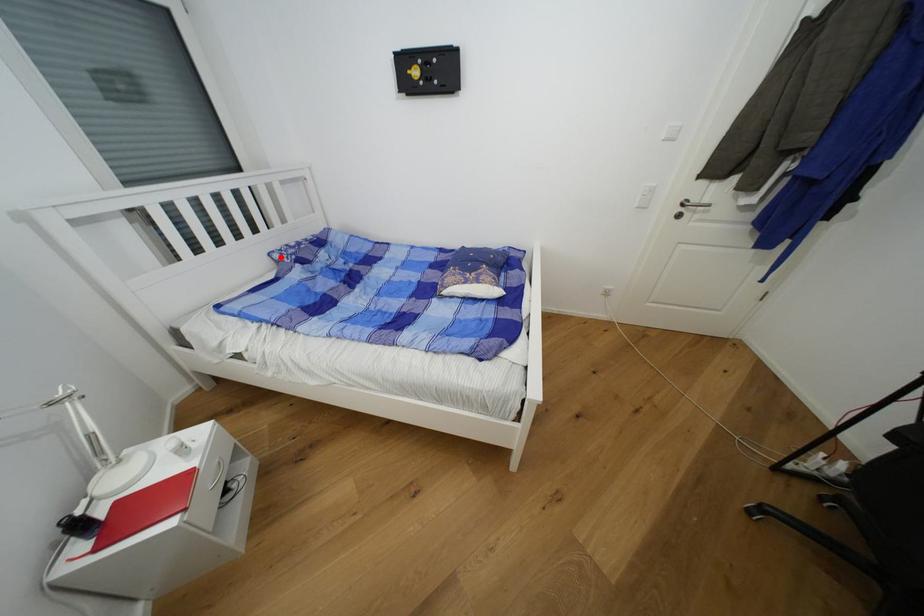
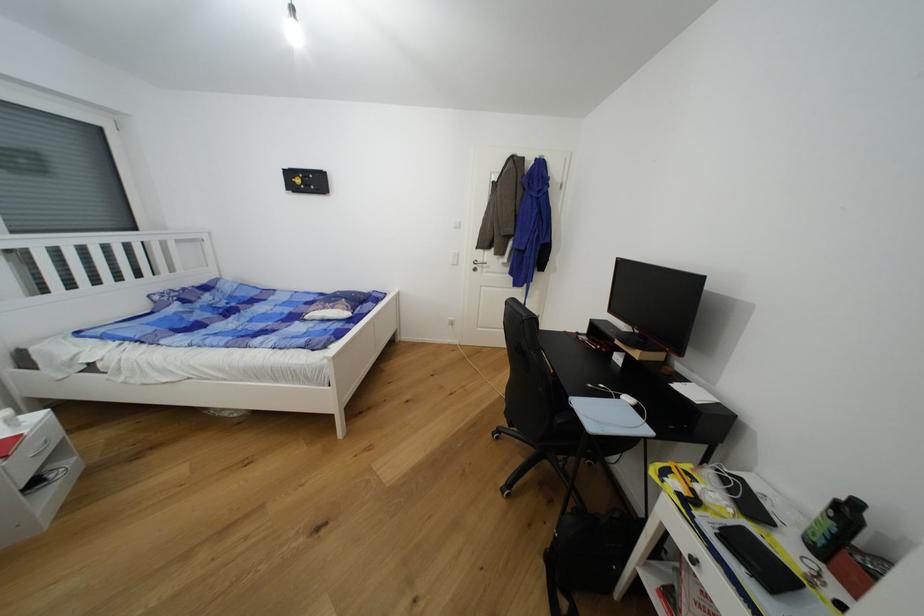
In the second image, find the point that corresponds to the highlighted location in the first image.

(162, 299)